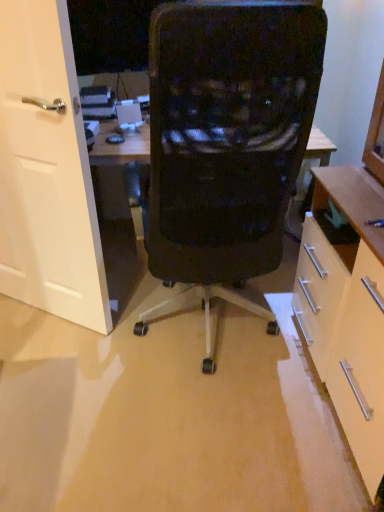
Question: Considering the positions of matte white cabinet at right and white matte door at left in the image, is matte white cabinet at right taller or shorter than white matte door at left?

Choices:
 (A) short
 (B) tall

Answer: (A)

Question: Considering the positions of point (311, 294) and point (66, 41), is point (311, 294) closer or farther from the camera than point (66, 41)?

Choices:
 (A) closer
 (B) farther

Answer: (B)

Question: Estimate the real-world distances between objects in this image. Which object is farther from the matte white cabinet at right?

Choices:
 (A) white matte door at left
 (B) black mesh chair at center

Answer: (A)

Question: Which object is the closest to the matte white cabinet at right?

Choices:
 (A) white matte door at left
 (B) black mesh chair at center

Answer: (B)